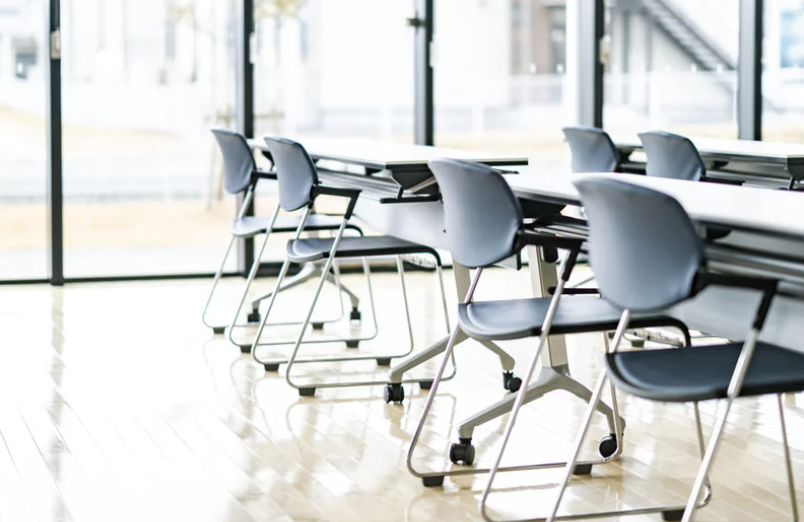
Locate an element on the screen. The height and width of the screenshot is (522, 804). chairs is located at coordinates (228, 167), (292, 177), (461, 209), (624, 249), (597, 138), (675, 158).